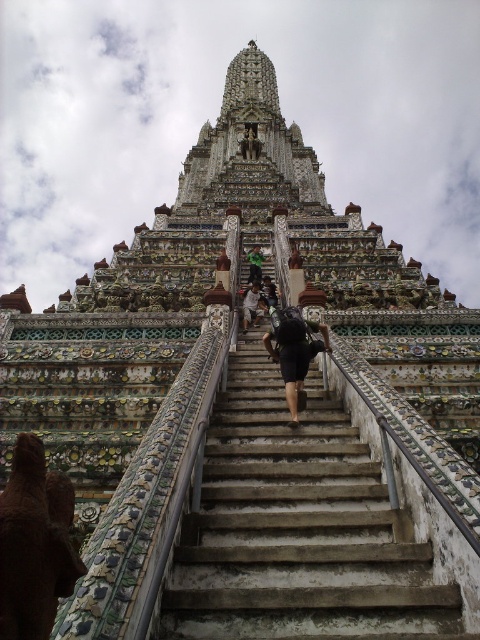
You are standing at the bottom of the staircase leading to Wat Arun Temple. You see a green fabric at center and a dark blue fabric backpack at center. Which object is wider?

The green fabric at center is wider than the dark blue fabric backpack at center.

You are standing at the base of the grand staircase leading to Wat Arun Temple. You see the concrete stairs at center and the black matte backpack at center. If you want to place your backpack on the stairs, will you need to walk towards or away from the temple?

The concrete stairs at center is 7.60 meters away from the black matte backpack at center. Since the backpack is closer to you than the stairs, you need to walk towards the temple to place it on the stairs.